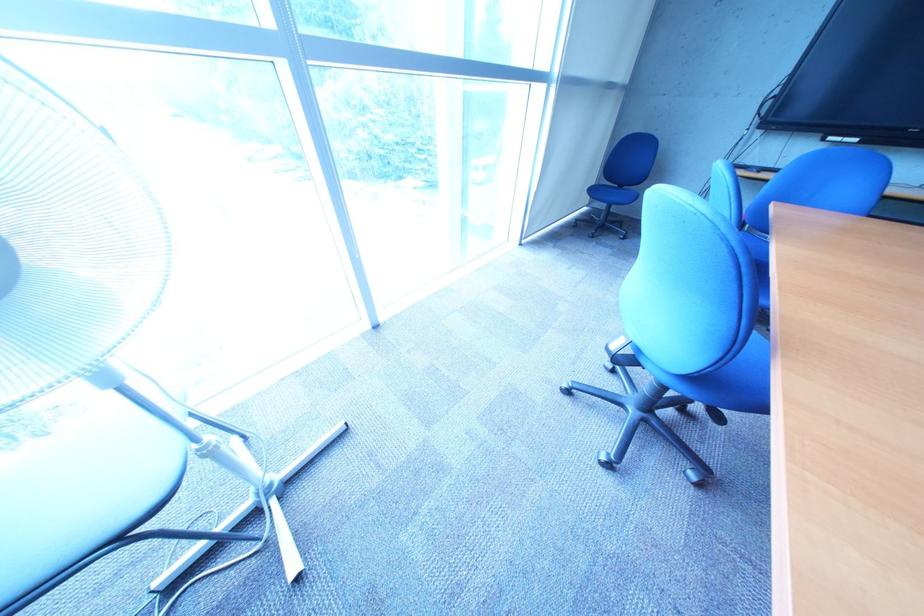
Describe the element at coordinates (217, 532) in the screenshot. I see `the white beaded chain` at that location.